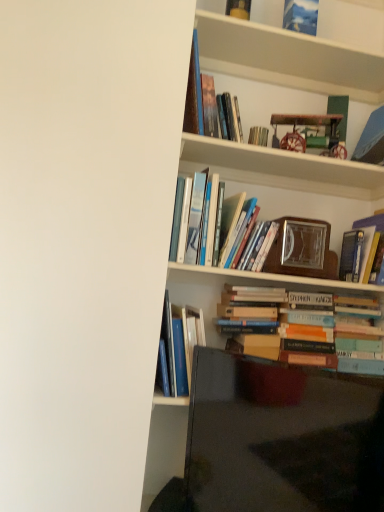
Question: Is wooden bookshelf at upper center to the right of hardcover books at center, which is the fifth book from bottom to top, from the viewer's perspective?

Choices:
 (A) yes
 (B) no

Answer: (A)

Question: From a real-world perspective, is wooden bookshelf at upper center positioned over hardcover books at center, which is counted as the fourth book, starting from the top, based on gravity?

Choices:
 (A) no
 (B) yes

Answer: (B)

Question: Is hardcover books at center, which is counted as the fourth book, starting from the top, at the back of wooden bookshelf at upper center?

Choices:
 (A) yes
 (B) no

Answer: (B)

Question: Is hardcover books at center, which is counted as the fourth book, starting from the top, located within wooden bookshelf at upper center?

Choices:
 (A) no
 (B) yes

Answer: (A)

Question: Can you confirm if wooden bookshelf at upper center is bigger than hardcover books at center, which is counted as the fourth book, starting from the top?

Choices:
 (A) yes
 (B) no

Answer: (B)

Question: In the image, is matte yellow book at upper center, marked as the eighth book in a bottom-to-top arrangement, on the left side or the right side of matte black tv at lower right?

Choices:
 (A) right
 (B) left

Answer: (B)

Question: In terms of width, does matte yellow book at upper center, arranged as the first book when viewed from the top, look wider or thinner when compared to matte black tv at lower right?

Choices:
 (A) thin
 (B) wide

Answer: (A)

Question: Relative to matte black tv at lower right, is matte yellow book at upper center, marked as the eighth book in a bottom-to-top arrangement, in front or behind?

Choices:
 (A) front
 (B) behind

Answer: (B)

Question: Choose the correct answer: Is matte yellow book at upper center, arranged as the first book when viewed from the top, inside matte black tv at lower right or outside it?

Choices:
 (A) outside
 (B) inside

Answer: (A)

Question: Looking at their shapes, would you say hardcover book at upper right, the 3th book in the bottom-to-top sequence, is wider or thinner than wooden clock at upper center?

Choices:
 (A) wide
 (B) thin

Answer: (A)

Question: Considering the relative positions of hardcover book at upper right, which appears as the sixth book when viewed from the top, and wooden clock at upper center in the image provided, is hardcover book at upper right, which appears as the sixth book when viewed from the top, to the left or to the right of wooden clock at upper center?

Choices:
 (A) right
 (B) left

Answer: (A)

Question: Is hardcover book at upper right, which appears as the sixth book when viewed from the top, in front of or behind wooden clock at upper center in the image?

Choices:
 (A) behind
 (B) front

Answer: (A)

Question: From the image's perspective, relative to wooden clock at upper center, is hardcover book at upper right, the 3th book in the bottom-to-top sequence, above or below?

Choices:
 (A) above
 (B) below

Answer: (B)

Question: Looking at their shapes, would you say matte yellow book at upper center, marked as the eighth book in a bottom-to-top arrangement, is wider or thinner than hardcover books at center, which is the fifth book from bottom to top?

Choices:
 (A) wide
 (B) thin

Answer: (B)

Question: From the image's perspective, is matte yellow book at upper center, arranged as the first book when viewed from the top, positioned above or below hardcover books at center, which is the fifth book from bottom to top?

Choices:
 (A) below
 (B) above

Answer: (B)